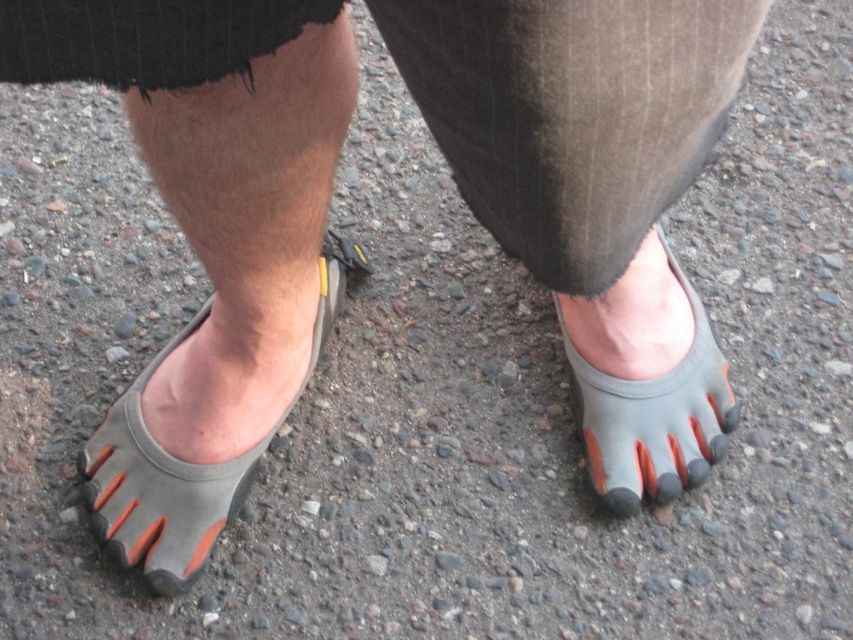
Question: Can you confirm if gray rubber toe shoe at center is positioned to the right of orange rubber toe at center?

Choices:
 (A) no
 (B) yes

Answer: (A)

Question: Does gray rubber toe shoe at center have a lesser width compared to gray rubber toe-separated shoe at lower center?

Choices:
 (A) no
 (B) yes

Answer: (A)

Question: Which of the following is the closest to the observer?

Choices:
 (A) gray rubber toe shoe at center
 (B) gray rubber toe-separated shoe at lower center
 (C) orange rubber toe at center

Answer: (A)

Question: Can you confirm if gray rubber toe-separated shoe at lower center is positioned to the right of orange rubber toe at center?

Choices:
 (A) no
 (B) yes

Answer: (A)

Question: Which object is positioned farthest from the gray rubber toe shoe at center?

Choices:
 (A) orange rubber toe at center
 (B) gray rubber toe-separated shoe at lower center

Answer: (A)

Question: Which object is positioned closest to the gray rubber toe shoe at center?

Choices:
 (A) orange rubber toe at center
 (B) gray rubber toe-separated shoe at lower center

Answer: (B)